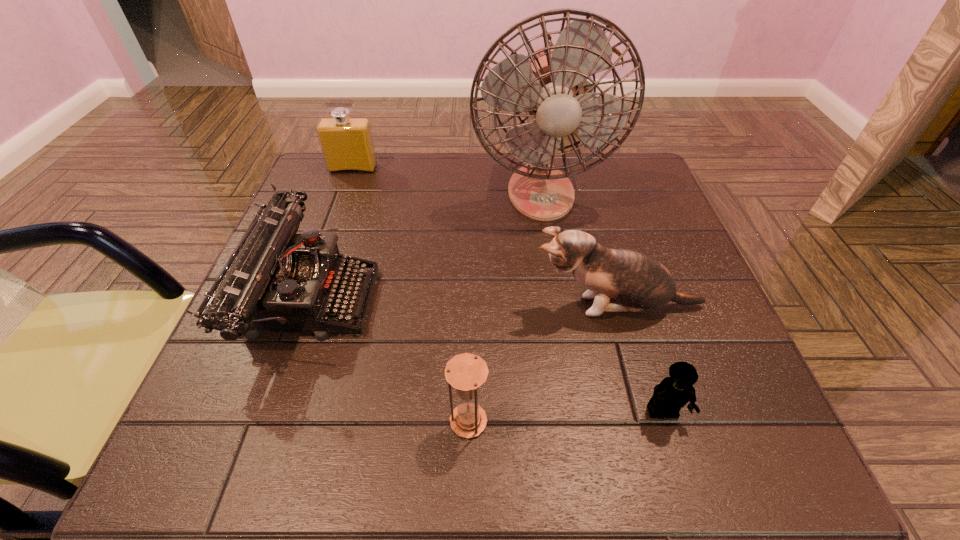
Where is `free space between the hourglass and the tallest object`? This screenshot has width=960, height=540. free space between the hourglass and the tallest object is located at coordinates (504, 307).

Where is `empty space between the typewriter and the cat`? Image resolution: width=960 pixels, height=540 pixels. empty space between the typewriter and the cat is located at coordinates (464, 302).

This screenshot has width=960, height=540. In order to click on free point between the hourglass and the tallest object in this screenshot , I will do `click(504, 307)`.

Find the location of a particular element. vacant space in between the typewriter and the shortest object is located at coordinates (487, 355).

At what (x,y) coordinates should I click in order to perform the action: click on free space between the perfume and the fan. Please return your answer as a coordinate pair (x, y). The width and height of the screenshot is (960, 540). Looking at the image, I should click on (446, 180).

This screenshot has width=960, height=540. What are the coordinates of `vacant area that lies between the typewriter and the Lego` in the screenshot? It's located at (487, 355).

This screenshot has height=540, width=960. In order to click on vacant area between the shortest object and the typewriter in this screenshot , I will do (487, 355).

This screenshot has width=960, height=540. What are the coordinates of `free space between the typewriter and the perfume` in the screenshot? It's located at (332, 233).

Identify which object is the closest to the typewriter. Please provide its 2D coordinates. Your answer should be formatted as a tuple, i.e. [(x, y)], where the tuple contains the x and y coordinates of a point satisfying the conditions above.

[(466, 372)]

I want to click on object that is the fifth nearest to the cat, so click(x=347, y=145).